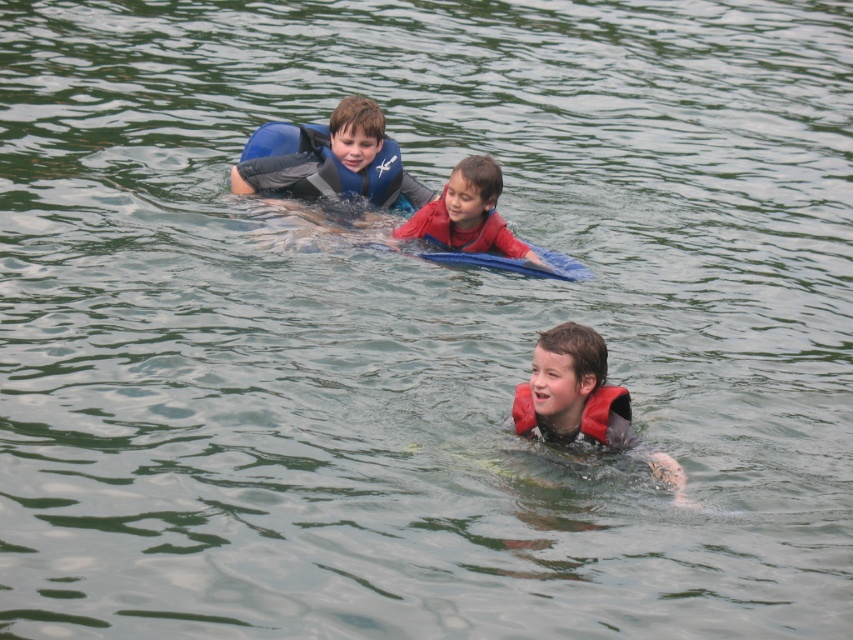
Which is above, red matte life vest at center or orange matte life jacket at center?

red matte life vest at center

Between point (409, 236) and point (601, 419), which one is positioned in front?

Point (601, 419) is more forward.

The height and width of the screenshot is (640, 853). Find the location of `red matte life vest at center`. red matte life vest at center is located at coordinates (467, 212).

Which is more to the left, red life vest at center or red matte life vest at center?

red matte life vest at center

Does red life vest at center have a lesser height compared to red matte life vest at center?

Incorrect, red life vest at center's height does not fall short of red matte life vest at center's.

Between point (590, 381) and point (473, 225), which one is positioned behind?

Point (473, 225)

Where is `red life vest at center`? red life vest at center is located at coordinates (x=572, y=392).

Is point (300, 128) more distant than point (490, 164)?

Yes, it is behind point (490, 164).

Is blue matte life jacket at upper center to the right of red matte life vest at center from the viewer's perspective?

Incorrect, blue matte life jacket at upper center is not on the right side of red matte life vest at center.

Does point (260, 189) come in front of point (540, 266)?

That is False.

The width and height of the screenshot is (853, 640). I want to click on blue matte life jacket at upper center, so click(x=318, y=166).